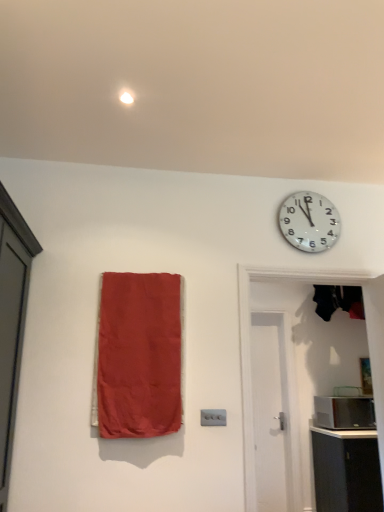
Question: Is white matte door at right, which ranks as the first door in front-to-back order, at the back of black glossy microwave at right?

Choices:
 (A) no
 (B) yes

Answer: (A)

Question: From a real-world perspective, is black glossy microwave at right below white matte door at right, the second door viewed from the back?

Choices:
 (A) yes
 (B) no

Answer: (A)

Question: Can you confirm if black glossy microwave at right is positioned to the left of white matte door at right, the second door viewed from the back?

Choices:
 (A) yes
 (B) no

Answer: (B)

Question: Is black glossy microwave at right wider than white matte door at right, which ranks as the first door in front-to-back order?

Choices:
 (A) yes
 (B) no

Answer: (A)

Question: Could you tell me if black glossy microwave at right is turned towards white matte door at right, which ranks as the first door in front-to-back order?

Choices:
 (A) no
 (B) yes

Answer: (A)

Question: Is black glossy microwave at right at the right side of white matte door at right, which ranks as the first door in front-to-back order?

Choices:
 (A) yes
 (B) no

Answer: (A)

Question: Is black glossy microwave at right thinner than matte fabric curtain at left?

Choices:
 (A) yes
 (B) no

Answer: (B)

Question: From the image's perspective, would you say black glossy microwave at right is shown under matte fabric curtain at left?

Choices:
 (A) no
 (B) yes

Answer: (B)

Question: From a real-world perspective, is black glossy microwave at right under matte fabric curtain at left?

Choices:
 (A) no
 (B) yes

Answer: (B)

Question: Does black glossy microwave at right contain matte fabric curtain at left?

Choices:
 (A) yes
 (B) no

Answer: (B)

Question: Would you consider black glossy microwave at right to be distant from matte fabric curtain at left?

Choices:
 (A) yes
 (B) no

Answer: (A)

Question: Are black glossy microwave at right and matte fabric curtain at left making contact?

Choices:
 (A) yes
 (B) no

Answer: (B)

Question: Considering the relative positions of matte fabric curtain at left and white glossy wall clock at upper right in the image provided, is matte fabric curtain at left to the left of white glossy wall clock at upper right from the viewer's perspective?

Choices:
 (A) no
 (B) yes

Answer: (B)